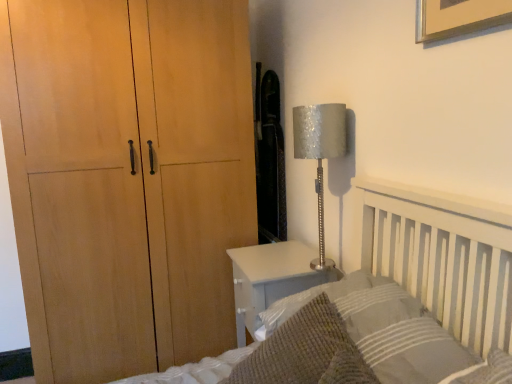
Question: In the image, is white glossy nightstand at lower right positioned in front of or behind knitted wool throw pillow at lower right?

Choices:
 (A) behind
 (B) front

Answer: (A)

Question: Is white glossy nightstand at lower right bigger or smaller than knitted wool throw pillow at lower right?

Choices:
 (A) small
 (B) big

Answer: (B)

Question: Estimate the real-world distances between objects in this image. Which object is farther from the textured gray pillow at lower right?

Choices:
 (A) silver textured lampshade at right
 (B) white glossy nightstand at lower right
 (C) knitted wool throw pillow at lower right

Answer: (A)

Question: Based on their relative distances, which object is nearer to the textured gray pillow at lower right?

Choices:
 (A) silver textured lampshade at right
 (B) white glossy nightstand at lower right
 (C) knitted wool throw pillow at lower right

Answer: (C)